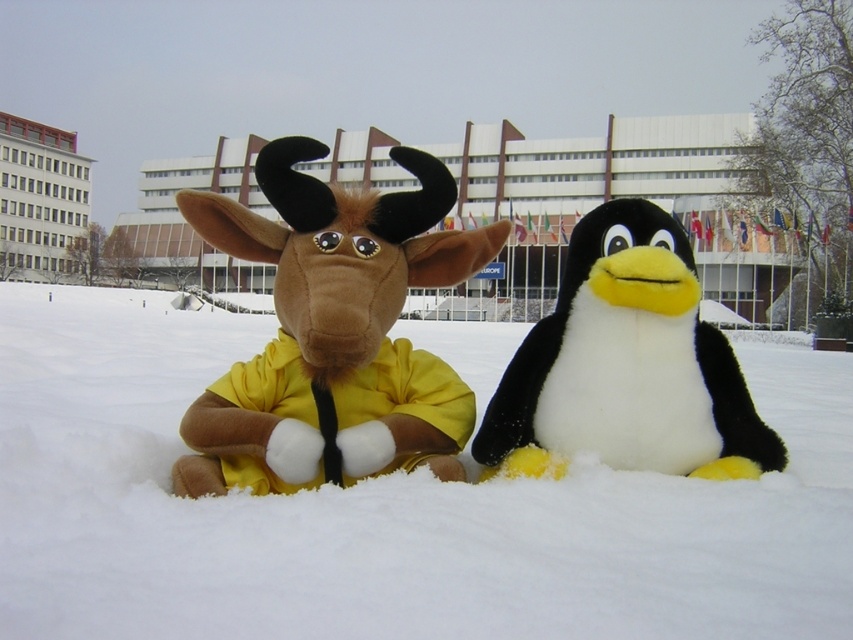
This screenshot has height=640, width=853. I want to click on white fluffy snow at center, so click(383, 509).

Does point (846, 577) come in front of point (756, 438)?

Yes.

Locate an element on the screen. The height and width of the screenshot is (640, 853). white fluffy snow at center is located at coordinates (383, 509).

Which is more to the right, fuzzy brown plush at center or black plush penguin at center?

Positioned to the right is black plush penguin at center.

Who is more distant from viewer, (221,419) or (622,310)?

Point (622,310)

Identify the location of fuzzy brown plush at center. (334, 332).

Can you confirm if white fluffy snow at center is positioned to the left of fuzzy brown plush at center?

Correct, you'll find white fluffy snow at center to the left of fuzzy brown plush at center.

Does white fluffy snow at center have a lesser height compared to fuzzy brown plush at center?

Incorrect, white fluffy snow at center's height does not fall short of fuzzy brown plush at center's.

Image resolution: width=853 pixels, height=640 pixels. Identify the location of white fluffy snow at center. (383, 509).